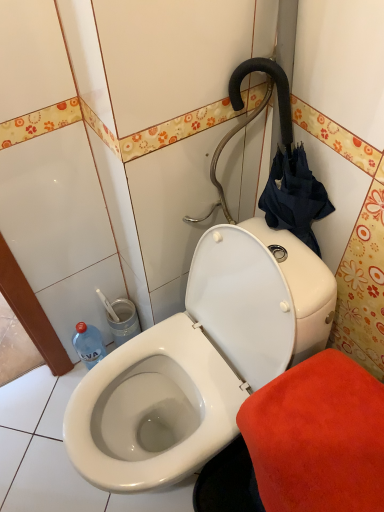
Where is `white glossy toilet at center`? white glossy toilet at center is located at coordinates (201, 360).

The height and width of the screenshot is (512, 384). What do you see at coordinates (201, 360) in the screenshot?
I see `white glossy toilet at center` at bounding box center [201, 360].

Where is `white glossy toilet at center`? white glossy toilet at center is located at coordinates pyautogui.click(x=201, y=360).